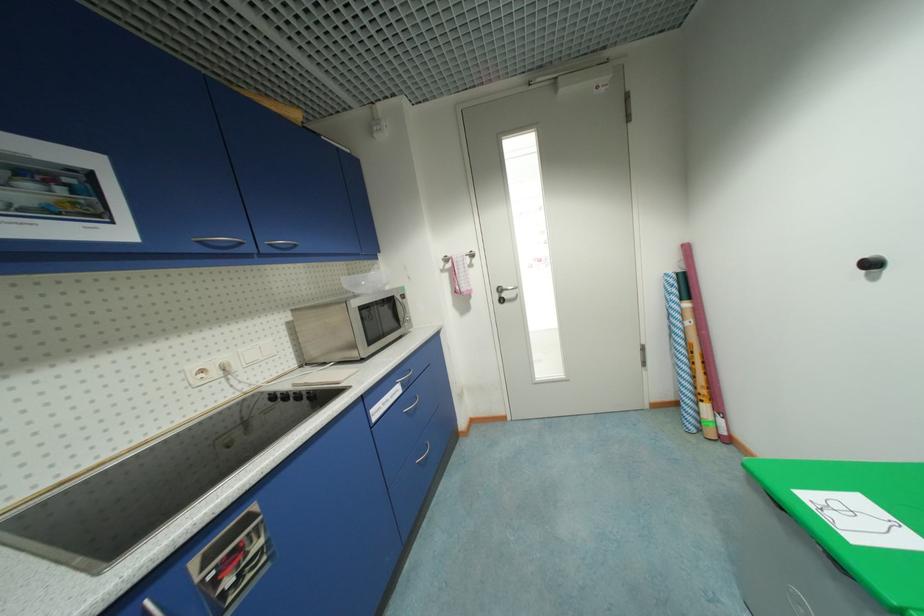
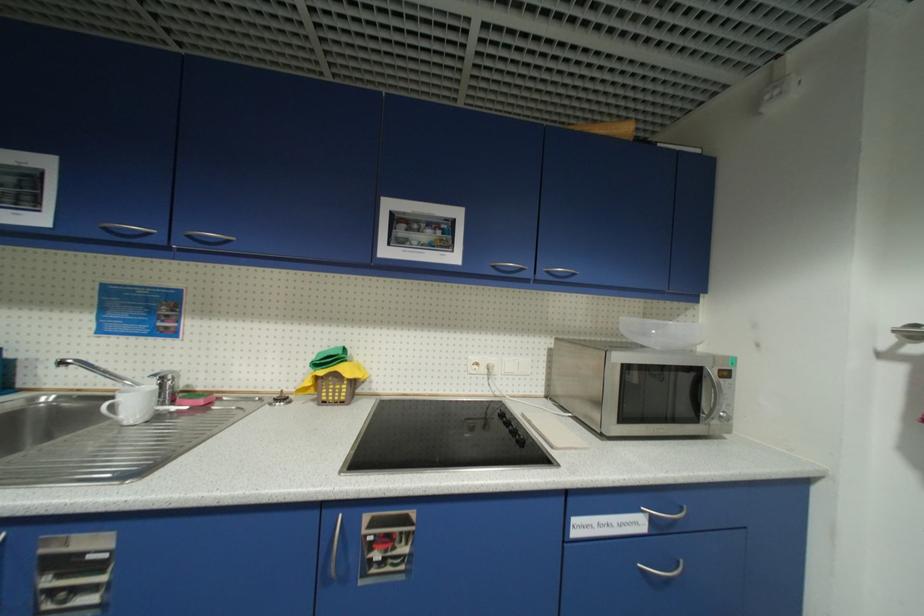
Question: How did the camera likely rotate?

Choices:
 (A) Left
 (B) Right
 (C) Up
 (D) Down

Answer: (A)